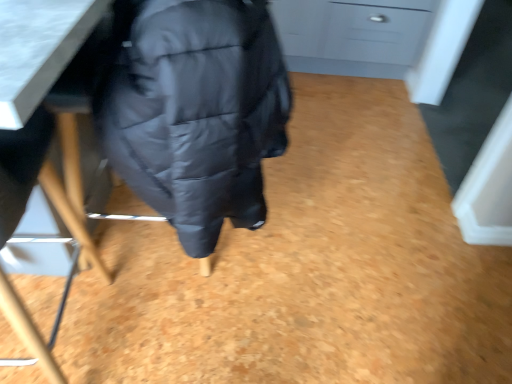
Question: Does matte gray drawer at upper right have a greater width compared to matte black chair at lower left?

Choices:
 (A) yes
 (B) no

Answer: (A)

Question: From the image's perspective, is matte gray drawer at upper right beneath matte black chair at lower left?

Choices:
 (A) no
 (B) yes

Answer: (A)

Question: Is matte gray drawer at upper right shorter than matte black chair at lower left?

Choices:
 (A) yes
 (B) no

Answer: (A)

Question: Is matte gray drawer at upper right further to camera compared to matte black chair at lower left?

Choices:
 (A) yes
 (B) no

Answer: (A)

Question: Is matte gray drawer at upper right positioned in front of matte black chair at lower left?

Choices:
 (A) yes
 (B) no

Answer: (B)

Question: Considering the positions of matte gray drawer at upper right and matte black jacket at under table in the image, is matte gray drawer at upper right bigger or smaller than matte black jacket at under table?

Choices:
 (A) small
 (B) big

Answer: (A)

Question: Based on their positions, is matte gray drawer at upper right located to the left or right of matte black jacket at under table?

Choices:
 (A) left
 (B) right

Answer: (B)

Question: In terms of width, does matte gray drawer at upper right look wider or thinner when compared to matte black jacket at under table?

Choices:
 (A) wide
 (B) thin

Answer: (A)

Question: Is matte gray drawer at upper right in front of or behind matte black jacket at under table in the image?

Choices:
 (A) front
 (B) behind

Answer: (B)

Question: Is matte black jacket at under table in front of or behind matte black chair at lower left in the image?

Choices:
 (A) behind
 (B) front

Answer: (A)

Question: From the image's perspective, is matte black jacket at under table positioned above or below matte black chair at lower left?

Choices:
 (A) above
 (B) below

Answer: (A)

Question: Looking at their shapes, would you say matte black jacket at under table is wider or thinner than matte black chair at lower left?

Choices:
 (A) wide
 (B) thin

Answer: (A)

Question: Is point (224, 11) closer or farther from the camera than point (24, 311)?

Choices:
 (A) closer
 (B) farther

Answer: (A)

Question: Relative to matte black jacket at under table, is matte black chair at lower left in front or behind?

Choices:
 (A) behind
 (B) front

Answer: (B)

Question: Would you say matte black chair at lower left is inside or outside matte black jacket at under table?

Choices:
 (A) inside
 (B) outside

Answer: (B)